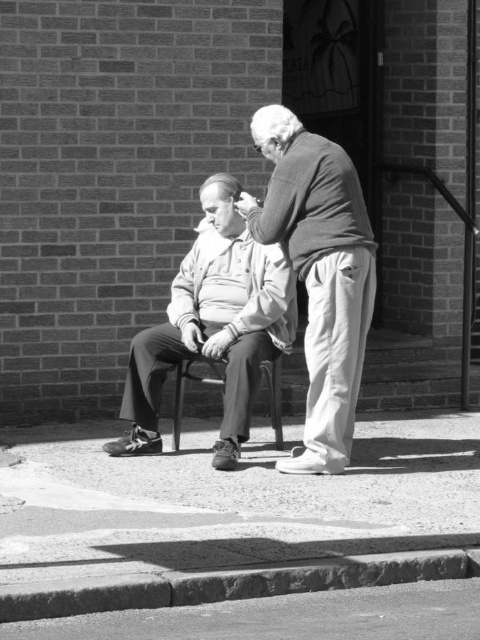
Question: Among these points, which one is farthest from the camera?

Choices:
 (A) (419, 552)
 (B) (255, 292)

Answer: (B)

Question: Which point is farther to the camera?

Choices:
 (A) matte gray sweater at center
 (B) metallic black chair at center

Answer: (B)

Question: Does matte gray sweater at center appear under smooth gray sweater at center?

Choices:
 (A) yes
 (B) no

Answer: (B)

Question: Is matte gray sweater at center to the right of smooth concrete curb at lower center from the viewer's perspective?

Choices:
 (A) yes
 (B) no

Answer: (A)

Question: Is smooth gray sweater at center behind metallic black chair at center?

Choices:
 (A) yes
 (B) no

Answer: (B)

Question: Which object is the closest to the smooth concrete pavement at lower center?

Choices:
 (A) smooth gray sweater at center
 (B) matte gray sweater at center
 (C) metallic black chair at center
 (D) smooth concrete curb at lower center

Answer: (D)